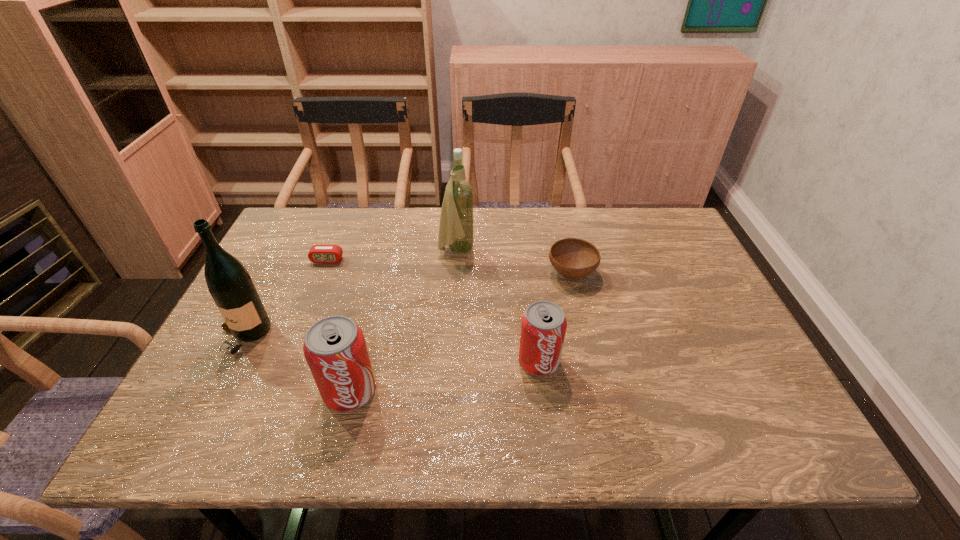
Locate an element on the screen. wine bottle that is positioned at the left edge is located at coordinates (229, 283).

The image size is (960, 540). Identify the location of free space at the far edge. (487, 212).

Where is `vacant space at the near edge of the desktop`? The width and height of the screenshot is (960, 540). vacant space at the near edge of the desktop is located at coordinates (563, 389).

In the image, there is a desktop. Where is `vacant space at the right edge`? This screenshot has height=540, width=960. vacant space at the right edge is located at coordinates (656, 256).

I want to click on free region at the far left corner of the desktop, so click(x=319, y=244).

Identify the location of free region at the near left corner of the desktop. Image resolution: width=960 pixels, height=540 pixels. (220, 388).

Find the location of a particular element. free space at the far right corner is located at coordinates (644, 240).

This screenshot has width=960, height=540. In the image, there is a desktop. Identify the location of vacant space at the near right corner. (722, 400).

Locate an element on the screen. The height and width of the screenshot is (540, 960). unoccupied position between the right soda can and the shortest object is located at coordinates (433, 310).

Where is `vacant area that lies between the second object from right to left and the leftmost object`? The height and width of the screenshot is (540, 960). vacant area that lies between the second object from right to left and the leftmost object is located at coordinates (392, 349).